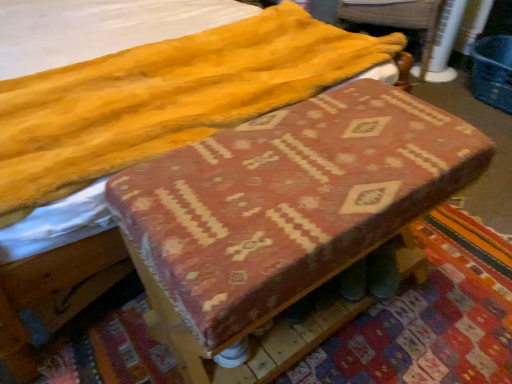
Where is `empty space that is ontop of textured fabric changing table at center (from a real-world perspective)`? The image size is (512, 384). empty space that is ontop of textured fabric changing table at center (from a real-world perspective) is located at coordinates [314, 155].